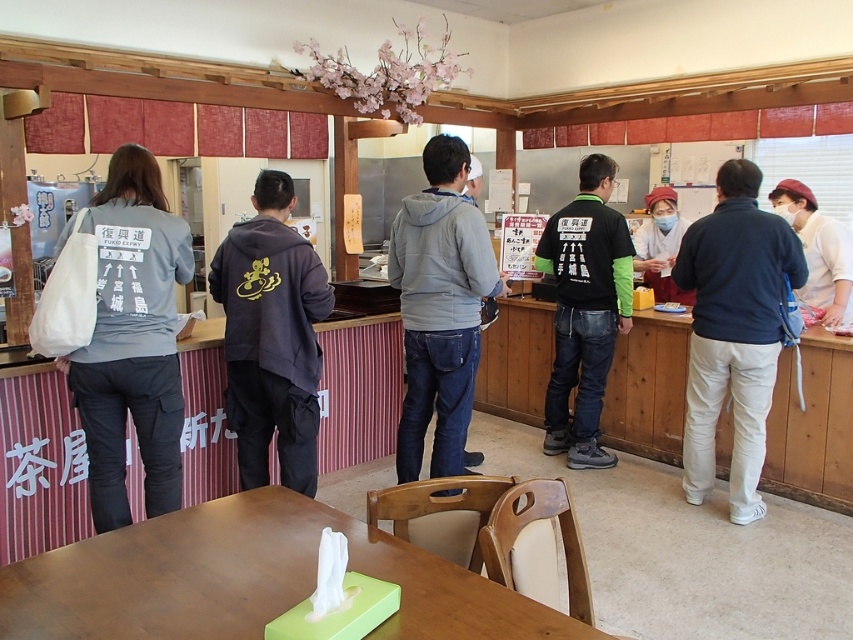
How far apart are gray cotton jacket at left and white cotton pants at right?

A distance of 8.11 feet exists between gray cotton jacket at left and white cotton pants at right.

Does gray cotton jacket at left have a lesser height compared to white cotton pants at right?

→ Yes, gray cotton jacket at left is shorter than white cotton pants at right.

I want to click on gray cotton jacket at left, so click(132, 340).

What do you see at coordinates (251, 579) in the screenshot?
I see `green matte table at lower center` at bounding box center [251, 579].

From the picture: Can you confirm if green matte table at lower center is shorter than white cotton pants at right?

Yes, green matte table at lower center is shorter than white cotton pants at right.

This screenshot has height=640, width=853. Describe the element at coordinates (251, 579) in the screenshot. I see `green matte table at lower center` at that location.

Locate an element on the screen. This screenshot has height=640, width=853. green matte table at lower center is located at coordinates (251, 579).

Can you confirm if green matte table at lower center is wider than gray fleece jacket at center?

Correct, the width of green matte table at lower center exceeds that of gray fleece jacket at center.

Who is more distant from viewer, [276,604] or [456,349]?

Positioned behind is point [456,349].

At what (x,y) coordinates should I click in order to perform the action: click on green matte table at lower center. Please return your answer as a coordinate pair (x, y). This screenshot has width=853, height=640. Looking at the image, I should click on (251, 579).